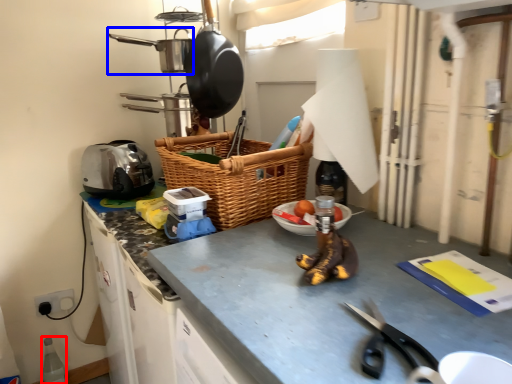
Question: Which of the following is the closest to the observer, bottle (highlighted by a red box) or frying pan (highlighted by a blue box)?

Choices:
 (A) bottle
 (B) frying pan

Answer: (B)